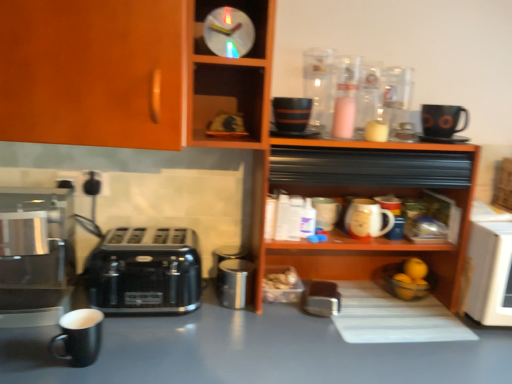
Identify the location of free space that is to the left of metallic silver canister at center. The height and width of the screenshot is (384, 512). (182, 310).